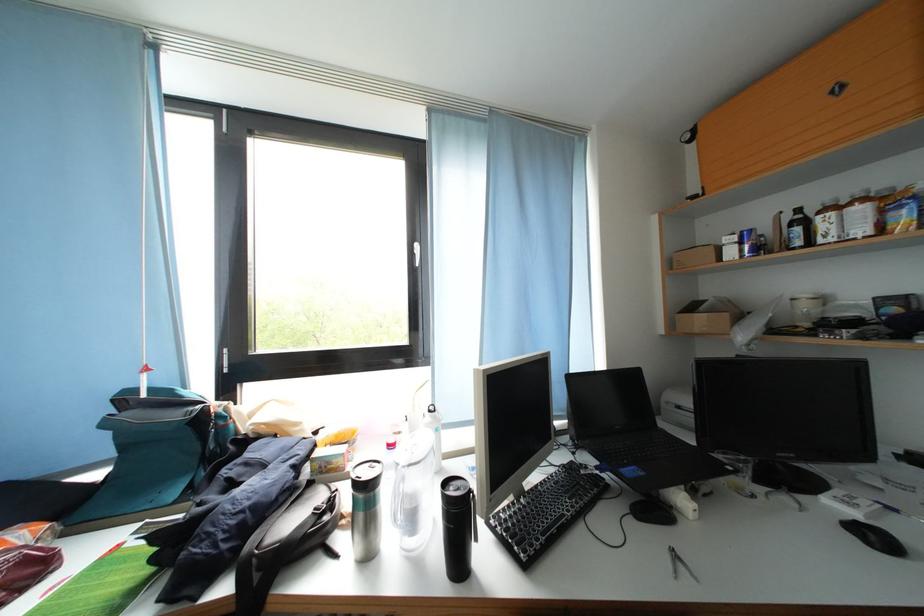
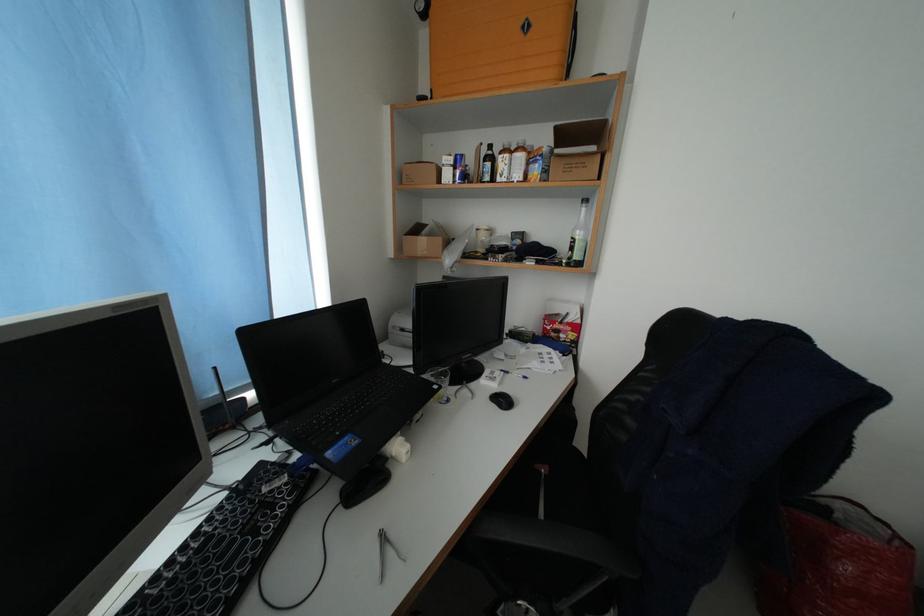
In the second image, find the point that corresponds to [737,472] in the first image.

(444, 392)